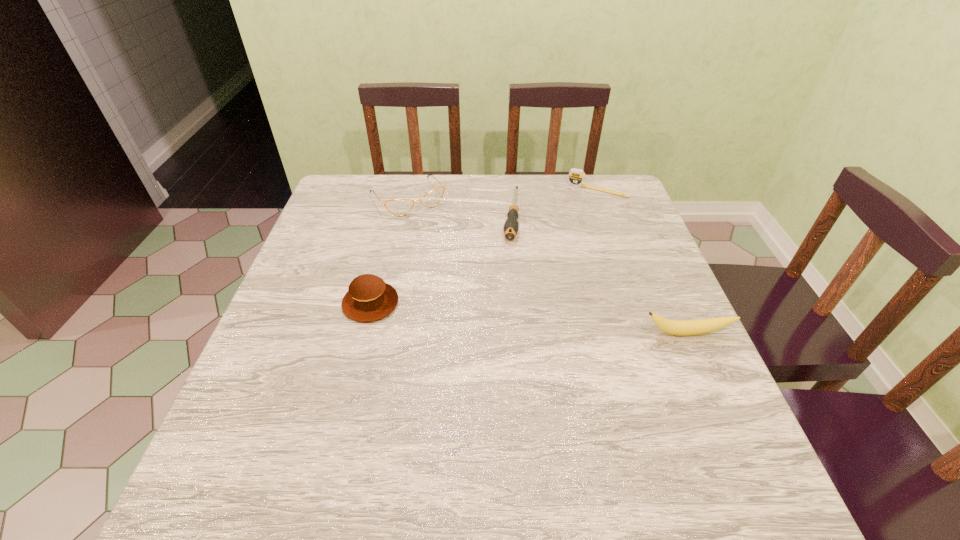
In order to click on free space between the second nearest object and the spectacles in this screenshot , I will do coord(390,251).

Identify the location of the second closest object relative to the spectacles. The width and height of the screenshot is (960, 540). (369, 298).

The width and height of the screenshot is (960, 540). Find the location of `object that is the fourth closest one to the spectacles`. object that is the fourth closest one to the spectacles is located at coordinates (674, 327).